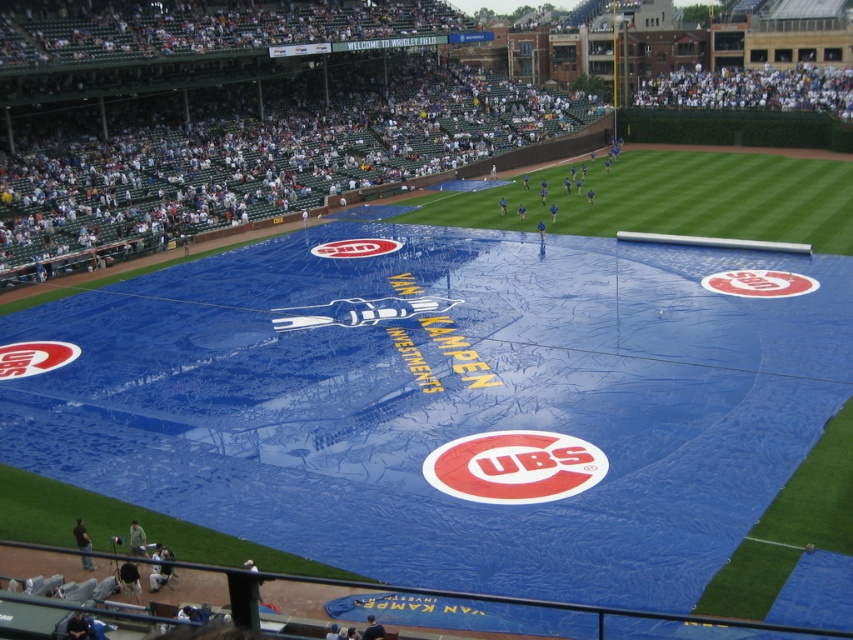
Question: Is red matte logo at center thinner than blue fabric tarp at center?

Choices:
 (A) no
 (B) yes

Answer: (A)

Question: Which is farther from the matte red circle at center?

Choices:
 (A) matte white logo at center
 (B) blue fabric tarp at center
 (C) red matte logo at center

Answer: (B)

Question: Which point is farther from the camera taking this photo?

Choices:
 (A) (726, 269)
 (B) (22, 348)
 (C) (338, 250)
 (D) (463, 448)

Answer: (C)

Question: Is red matte logo at center positioned in front of matte red circle at center?

Choices:
 (A) no
 (B) yes

Answer: (B)

Question: Is matte red circle at center wider than matte white logo at center?

Choices:
 (A) no
 (B) yes

Answer: (A)

Question: Which point appears closest to the camera in this image?

Choices:
 (A) (796, 276)
 (B) (448, 476)
 (C) (376, 243)
 (D) (1, 348)

Answer: (B)